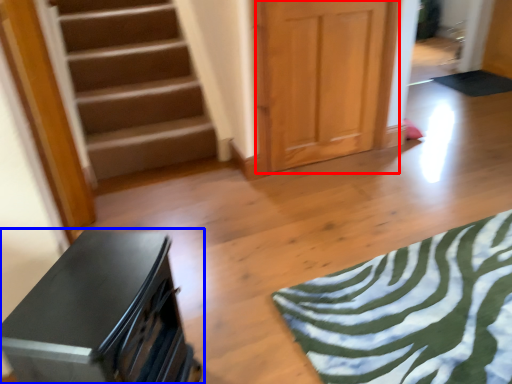
Question: Which of the following is the farthest to the observer, door (highlighted by a red box) or furniture (highlighted by a blue box)?

Choices:
 (A) door
 (B) furniture

Answer: (A)